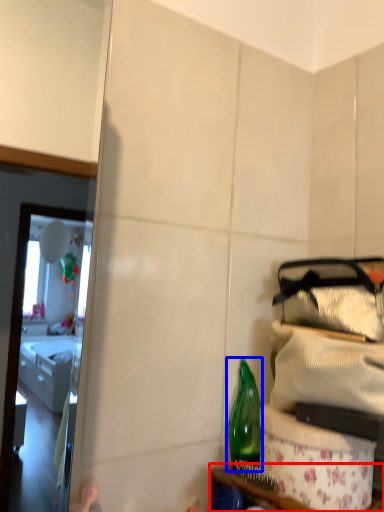
Question: Among these objects, which one is nearest to the camera, furniture (highlighted by a red box) or bottle (highlighted by a blue box)?

Choices:
 (A) furniture
 (B) bottle

Answer: (A)